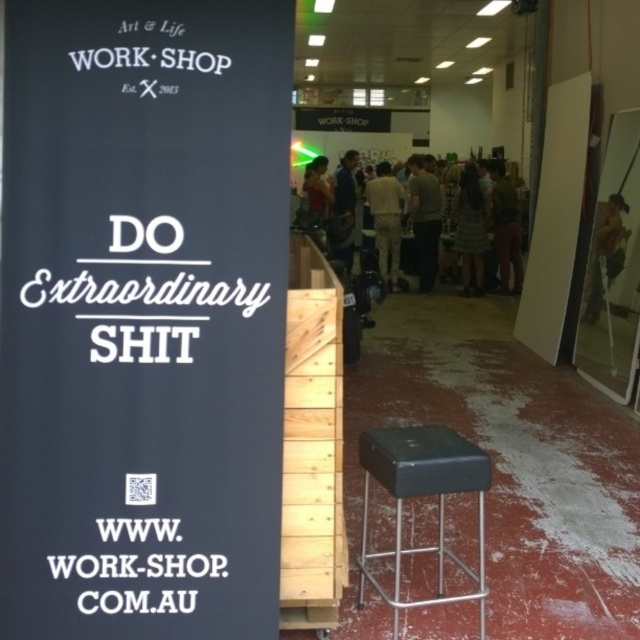
Question: Which point is closer to the camera taking this photo?

Choices:
 (A) (612, 273)
 (B) (342, 198)
 (C) (396, 278)

Answer: (A)

Question: Is black fabric sign at left to the left of matte red shirt at center from the viewer's perspective?

Choices:
 (A) no
 (B) yes

Answer: (B)

Question: Can you confirm if black fabric sign at left is positioned below dark gray dress at center?

Choices:
 (A) yes
 (B) no

Answer: (A)

Question: Can you confirm if light brown leather jacket at center is positioned below green fabric pants at center?

Choices:
 (A) no
 (B) yes

Answer: (B)

Question: Which point is closer to the camera?

Choices:
 (A) black fabric sign at left
 (B) matte red shirt at center
 (C) dark gray dress at center

Answer: (A)

Question: Which point is closer to the camera taking this photo?

Choices:
 (A) (403, 204)
 (B) (588, 301)
 (C) (314, 172)

Answer: (B)